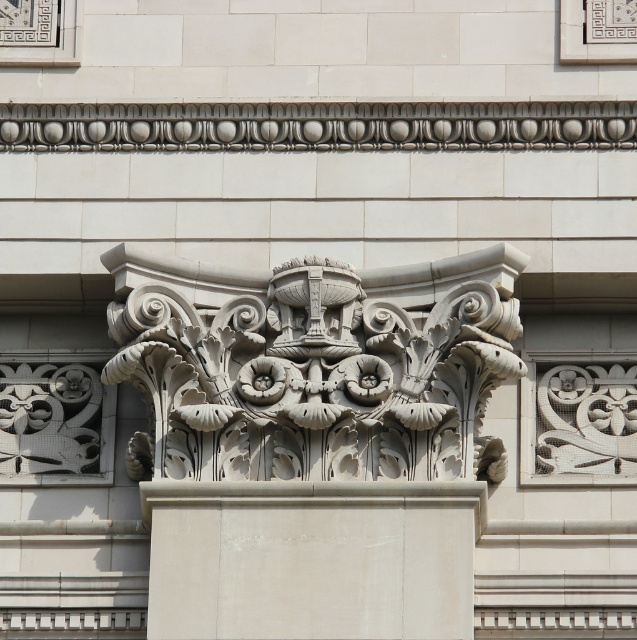
You are an architect designing a replica of this classical column. The column you have is 4 meters tall. If the distance between the white stone column capital at center and the white stone column at center is 3.24 meters, will the capital fit on top of the column without exceeding its height?

The distance between the white stone column capital at center and the white stone column at center is 3.24 meters. Since the column is 4 meters tall, subtracting the capital height leaves 0.76 meters remaining. However, the question does not provide the capital height, so we cannot determine if it fits. Please check the capital dimensions.

You are an architect examining the classical building detail. You notice the white stone column capital at center and the white stone column at center. Which one is positioned higher up in the image?

The white stone column capital at center is located above the white stone column at center, so it is positioned higher up in the image.

You are an architect designing a replica of this classical building. You need to ensure that the white stone column capital at center and the white stone column at center are proportionate. Based on the image, which one should be scaled down to match the other?

The white stone column capital at center is bigger than the white stone column at center. Therefore, the capital should be scaled down to match the column.